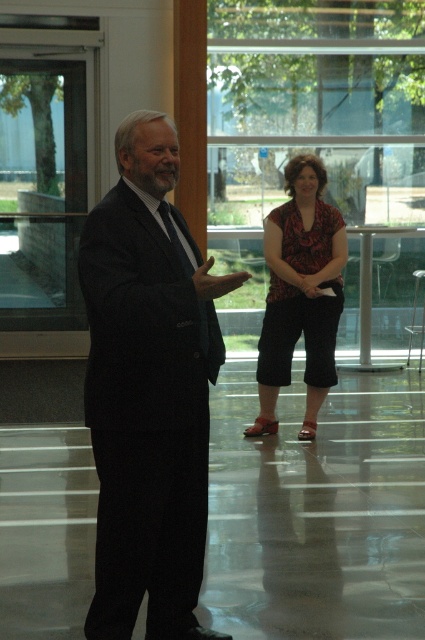
Can you confirm if floral fabric blouse at center is smaller than black silk tie at center?

No, floral fabric blouse at center is not smaller than black silk tie at center.

Between floral fabric blouse at center and black silk tie at center, which one is positioned lower?

black silk tie at center is below.

Which is behind, point (272, 372) or point (176, 244)?

The point (272, 372) is behind.

You are a GUI agent. You are given a task and a screenshot of the screen. Output one action in this format:
    pyautogui.click(x=<x>, y=<y>)
    Task: Click on the floral fabric blouse at center
    This screenshot has height=640, width=425.
    Given the screenshot: What is the action you would take?
    [300, 292]

Is matte black suit at center further to the viewer compared to black silk tie at center?

No.

Based on the photo, does matte black suit at center lie in front of black silk tie at center?

That is True.

At what (x,y) coordinates should I click in order to perform the action: click on matte black suit at center. Please return your answer as a coordinate pair (x, y). Looking at the image, I should click on (149, 390).

This screenshot has height=640, width=425. Identify the location of matte black suit at center. (149, 390).

Find the location of a particular element. The image size is (425, 640). matte black suit at center is located at coordinates (149, 390).

Looking at this image, who is positioned more to the left, matte black suit at center or floral fabric blouse at center?

matte black suit at center is more to the left.

Does point (156, 195) come behind point (319, 388)?

No, (156, 195) is closer to viewer.

Where is `matte black suit at center`? matte black suit at center is located at coordinates (149, 390).